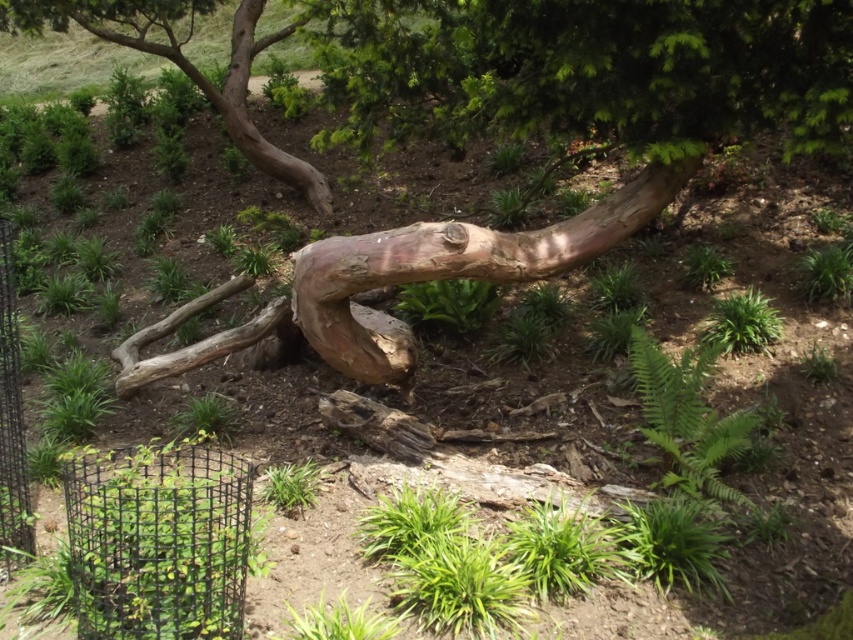
The height and width of the screenshot is (640, 853). What do you see at coordinates (183, 61) in the screenshot?
I see `brown rough bark tree at upper left` at bounding box center [183, 61].

Is point (157, 52) farther from viewer compared to point (0, 522)?

Yes, point (157, 52) is behind point (0, 522).

The height and width of the screenshot is (640, 853). What do you see at coordinates (183, 61) in the screenshot?
I see `brown rough bark tree at upper left` at bounding box center [183, 61].

This screenshot has height=640, width=853. Identify the location of brown rough bark tree at upper left. [183, 61].

Between natural wood tree trunk at center and black wire fence at lower left, which one appears on the right side from the viewer's perspective?

natural wood tree trunk at center

Does natural wood tree trunk at center have a larger size compared to black wire fence at lower left?

Indeed, natural wood tree trunk at center has a larger size compared to black wire fence at lower left.

Is point (387, 362) positioned behind point (0, 500)?

Yes, point (387, 362) is behind point (0, 500).

This screenshot has width=853, height=640. What are the coordinates of `natural wood tree trunk at center` in the screenshot? It's located at (403, 282).

Can you confirm if natural wood tree trunk at center is positioned above brown rough bark tree at upper left?

Actually, natural wood tree trunk at center is below brown rough bark tree at upper left.

Can you confirm if natural wood tree trunk at center is thinner than brown rough bark tree at upper left?

Indeed, natural wood tree trunk at center has a lesser width compared to brown rough bark tree at upper left.

Who is more distant from viewer, (451,253) or (21,1)?

Positioned behind is point (21,1).

Image resolution: width=853 pixels, height=640 pixels. What are the coordinates of `natural wood tree trunk at center` in the screenshot? It's located at (403, 282).